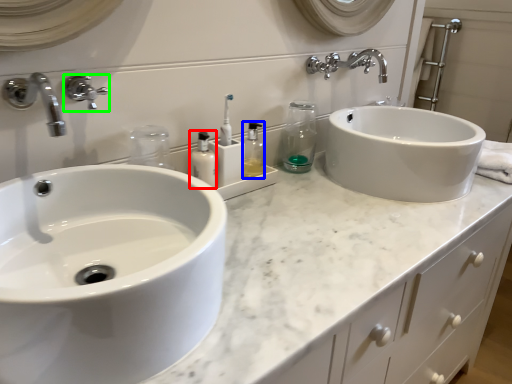
Question: Which object is positioned farthest from mouthwash (highlighted by a red box)? Select from toiletry (highlighted by a blue box) and tap (highlighted by a green box).

Choices:
 (A) toiletry
 (B) tap

Answer: (B)